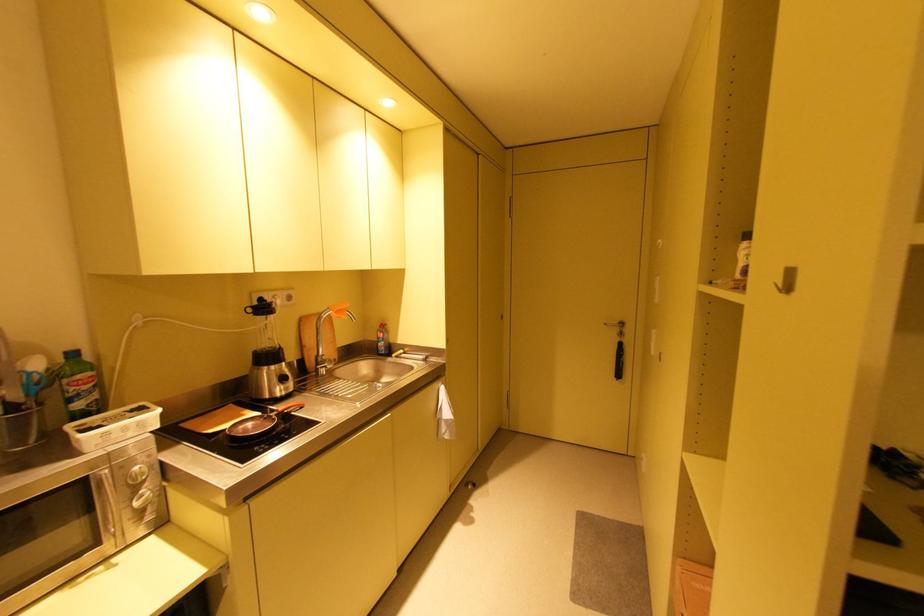
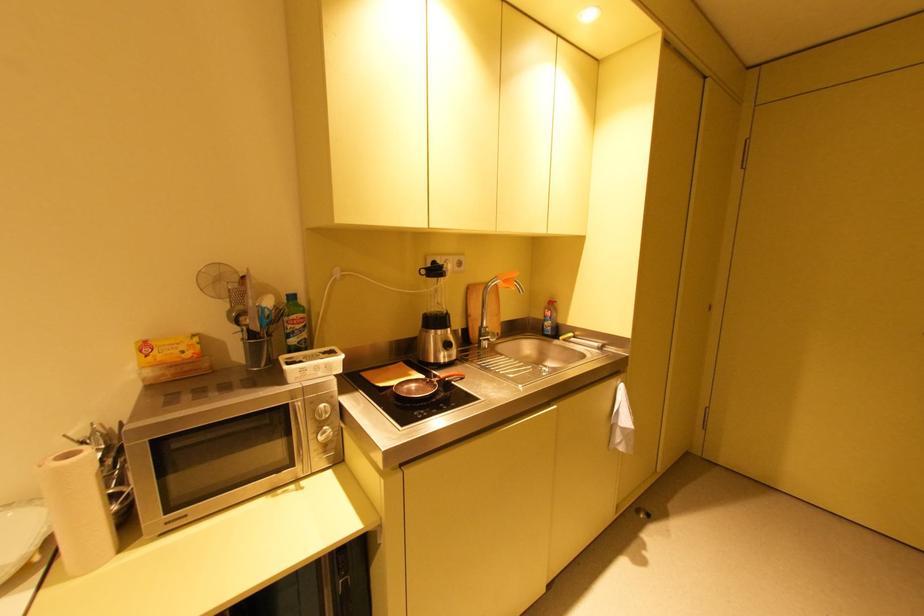
The point at (80,389) is marked in the first image. Where is the corresponding point in the second image?

(296, 326)